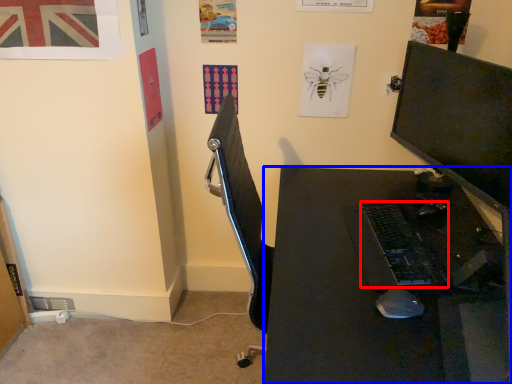
Question: Which of the following is the farthest to the observer, computer keyboard (highlighted by a red box) or desk (highlighted by a blue box)?

Choices:
 (A) computer keyboard
 (B) desk

Answer: (A)